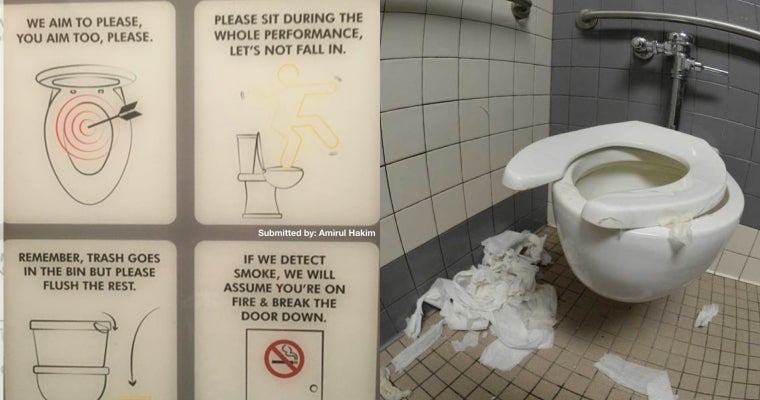
Where is `wall`? The height and width of the screenshot is (400, 760). wall is located at coordinates (520, 78).